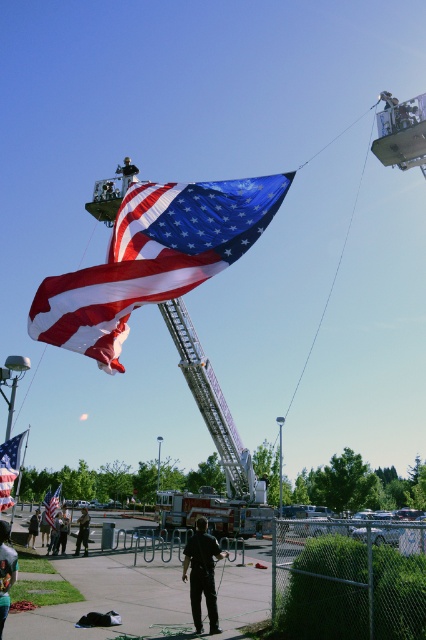
You are a photographer trying to capture the flag being hoisted by the crane attached to the fire truck on the left. There is a person in a dark green uniform at center. To avoid them in your shot, which direction should you move your camera? Please respond with a direction like north, south, east, or west based on the coordinate system where the image center is at point 0.5, 0.5 and the coordinate increases to the right and down.

The dark green uniform at center is located at point [83,531]. Since the image center is at [213,320], moving the camera west would reduce the x coordinate, moving left, which would help avoid the person in the dark green uniform at center.

You are attending a flag raising ceremony and notice two people in the scene. One is wearing a dark green uniform at center and the other a dark brown leather jacket at lower left. Based on their clothing sizes, which person is more likely to be the crane operator controlling the flag hoisting?

The dark green uniform at center is larger in size compared to the dark brown leather jacket at lower left, so the person in the dark green uniform at center is more likely to be the crane operator as they may need more space for operational movements.

You are a photographer trying to capture the silver metallic flag pole at upper center and the black matte pants at lower center in a single shot. Which object should you focus on first if you want to ensure both are in frame without moving the camera?

You should focus on the silver metallic flag pole at upper center first because the black matte pants at lower center is narrower, so adjusting the frame to include the wider silver metallic flag pole at upper center will naturally include the narrower black matte pants at lower center as well.